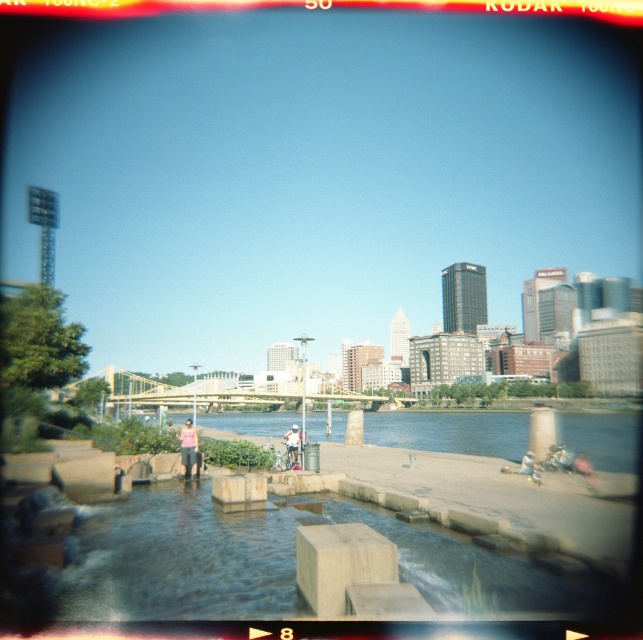
You are standing at the riverside and want to take a photo of the clear water at center and the white cotton shirt at center. Which object should you focus on first to ensure it appears sharp in the photo?

You should focus on the white cotton shirt at center first because it is closer to you than the clear water at center, which is further away. This ensures the shirt will be in focus, and the water may appear slightly blurred due to its distance.

You are a photographer trying to capture the entire scene in a single shot. Given that your camera has a limited field of view, which object between the clear water at center and the white cotton shirt at center should you prioritize framing to ensure both are visible?

The clear water at center is bigger than the white cotton shirt at center, so you should prioritize framing the clear water at center to ensure both are visible in the shot.